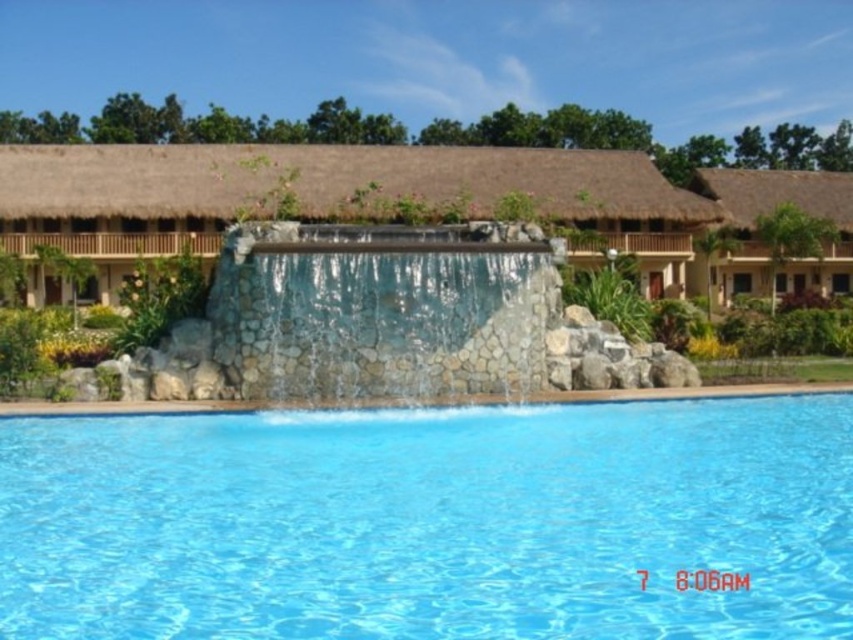
Looking at this image, is the position of clear blue water at center less distant than that of brown thatch hut at center?

Yes, it is in front of brown thatch hut at center.

Find the location of a particular element. This screenshot has height=640, width=853. clear blue water at center is located at coordinates (431, 522).

Which is behind, point (795, 476) or point (291, 168)?

The point (291, 168) is behind.

Where is `clear blue water at center`? The width and height of the screenshot is (853, 640). clear blue water at center is located at coordinates (431, 522).

Can you confirm if brown thatch hut at center is positioned to the left of thatched roof hut at upper right?

Yes, brown thatch hut at center is to the left of thatched roof hut at upper right.

Between brown thatch hut at center and thatched roof hut at upper right, which one has less height?

brown thatch hut at center

Between point (418, 173) and point (699, 264), which one is positioned behind?

Positioned behind is point (699, 264).

This screenshot has width=853, height=640. Find the location of `brown thatch hut at center`. brown thatch hut at center is located at coordinates (326, 195).

Based on the photo, does clear blue water at center have a lesser height compared to translucent stone waterfall at center?

Yes.

Is clear blue water at center to the right of translucent stone waterfall at center from the viewer's perspective?

Yes, clear blue water at center is to the right of translucent stone waterfall at center.

Identify the location of clear blue water at center. (431, 522).